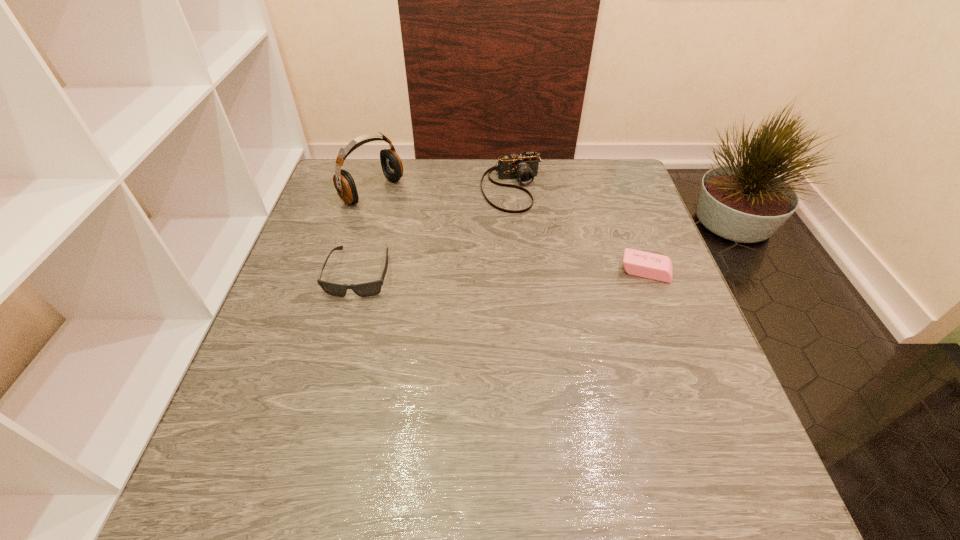
Identify the location of free space located on the ear cups of the tallest object. The width and height of the screenshot is (960, 540). click(449, 241).

Where is `vacant space located 0.090m on the front-facing side of the camera`? This screenshot has width=960, height=540. vacant space located 0.090m on the front-facing side of the camera is located at coordinates (528, 234).

I want to click on vacant space located 0.300m on the front-facing side of the camera, so click(551, 294).

Where is `free space located 0.400m on the front-facing side of the camera`? free space located 0.400m on the front-facing side of the camera is located at coordinates (564, 329).

Find the location of `headset located at the far edge`. headset located at the far edge is located at coordinates (392, 167).

I want to click on camera that is positioned at the far edge, so click(524, 166).

The width and height of the screenshot is (960, 540). Find the location of `sunglasses present at the left edge`. sunglasses present at the left edge is located at coordinates (373, 288).

I want to click on headset at the left edge, so click(x=392, y=167).

Where is `object that is at the right edge`? This screenshot has width=960, height=540. object that is at the right edge is located at coordinates (648, 265).

In order to click on object present at the far left corner in this screenshot , I will do `click(392, 167)`.